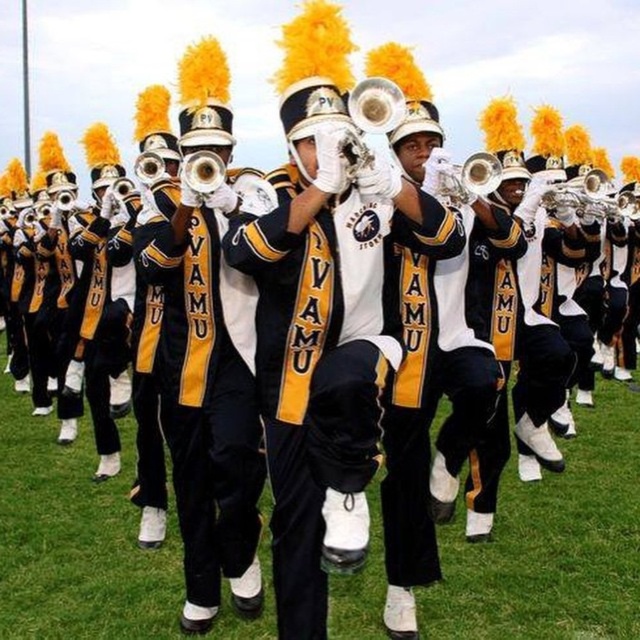
Who is shorter, black matte uniform at center or matte brass trumpet at center?

matte brass trumpet at center

Based on the photo, who is higher up, black matte uniform at center or matte brass trumpet at center?

matte brass trumpet at center is higher up.

Between point (208, 282) and point (198, 164), which one is positioned behind?

Point (208, 282)

This screenshot has width=640, height=640. Identify the location of black matte uniform at center. (205, 397).